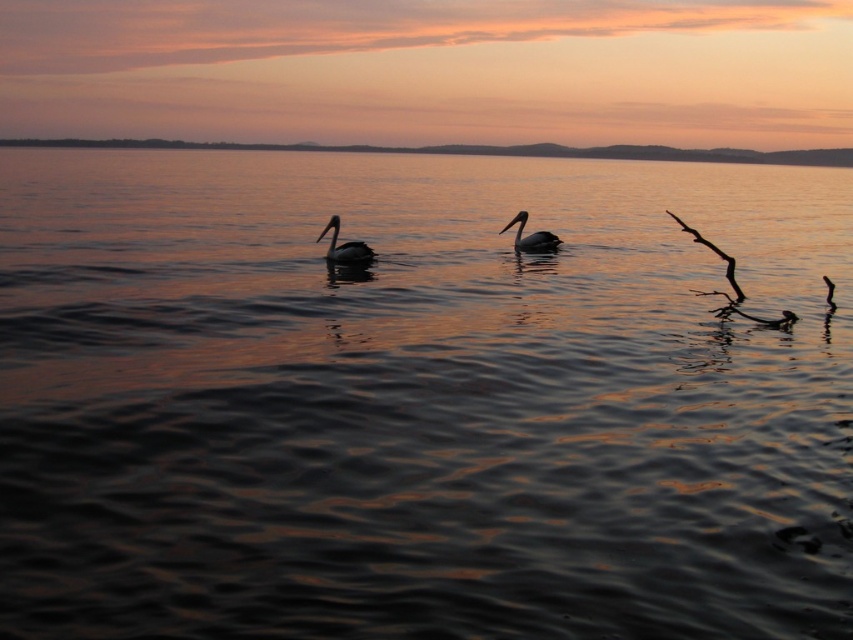
Question: Is dark gray matte pelican at center positioned at the back of matte gray duck at center?

Choices:
 (A) yes
 (B) no

Answer: (B)

Question: In this image, where is dark gray matte pelican at center located relative to matte gray duck at center?

Choices:
 (A) right
 (B) left

Answer: (B)

Question: Is dark gray matte pelican at center further to the viewer compared to matte gray duck at center?

Choices:
 (A) no
 (B) yes

Answer: (A)

Question: Which point is closer to the camera?

Choices:
 (A) (345, 250)
 (B) (550, 248)

Answer: (A)